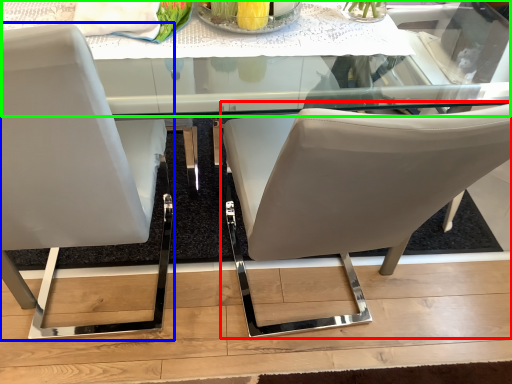
Question: Estimate the real-world distances between objects in this image. Which object is farther from chair (highlighted by a red box), chair (highlighted by a blue box) or round table (highlighted by a green box)?

Choices:
 (A) chair
 (B) round table

Answer: (B)